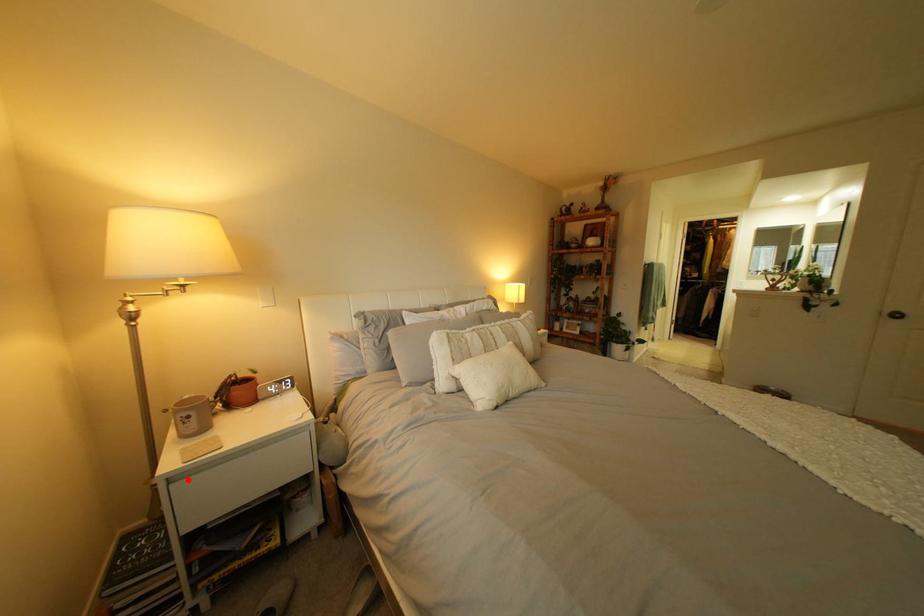
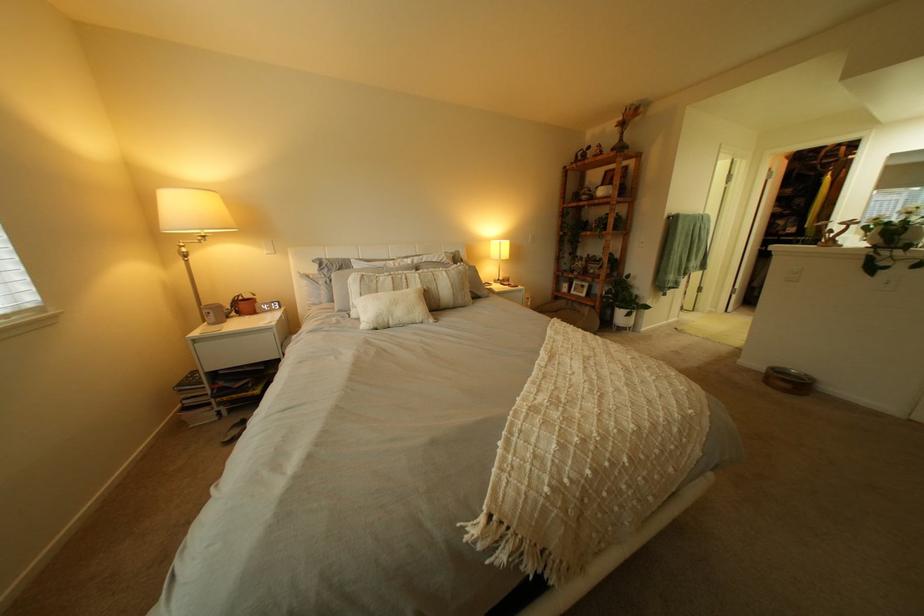
The point at the highlighted location is marked in the first image. Where is the corresponding point in the second image?

(211, 342)